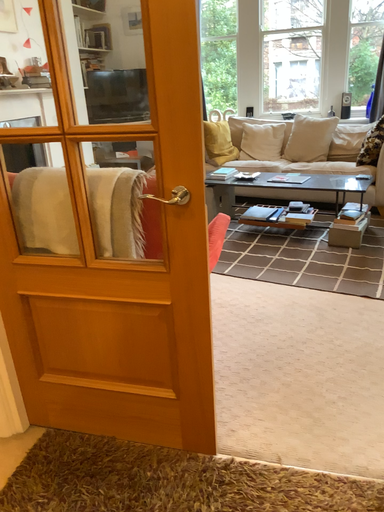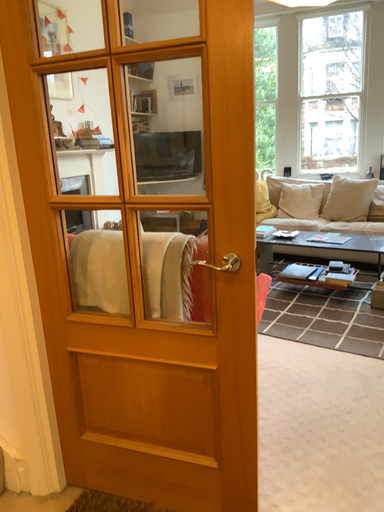
Question: How did the camera likely rotate when shooting the video?

Choices:
 (A) rotated downward
 (B) rotated upward

Answer: (B)